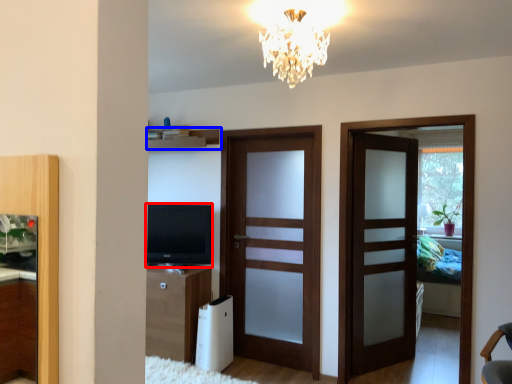
Question: Which point is further to the camera, television (highlighted by a red box) or shelf (highlighted by a blue box)?

Choices:
 (A) television
 (B) shelf

Answer: (B)